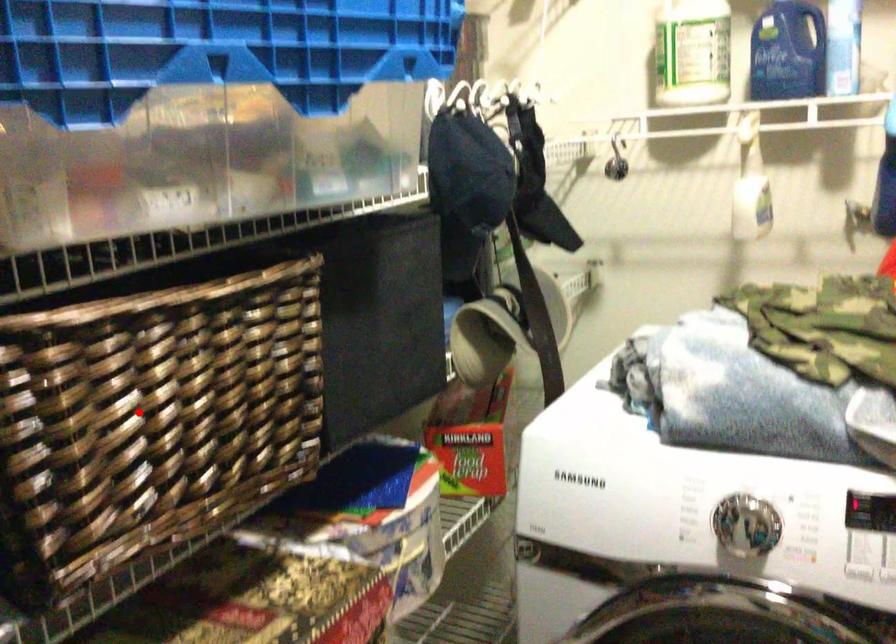
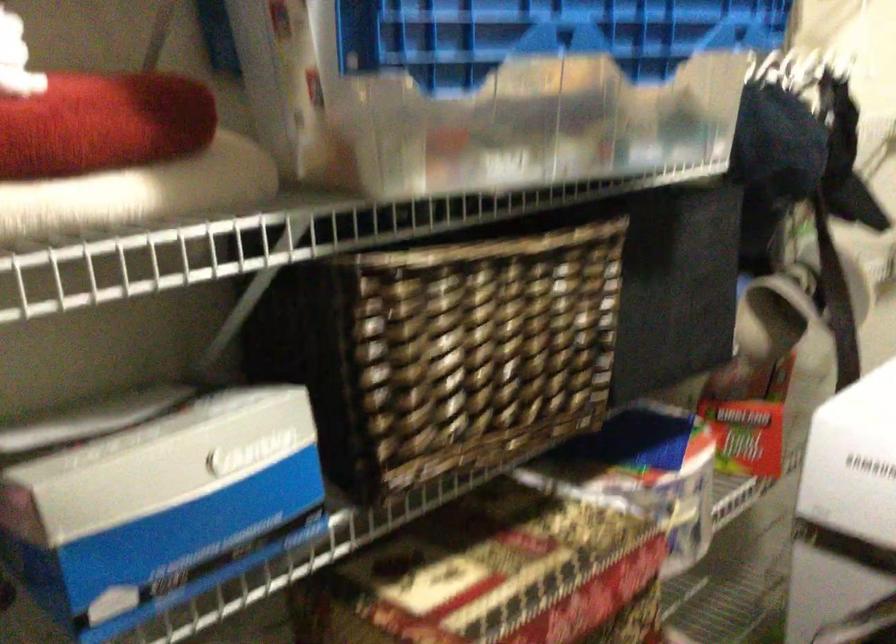
In the second image, find the point that corresponds to the highlighted location in the first image.

(453, 344)